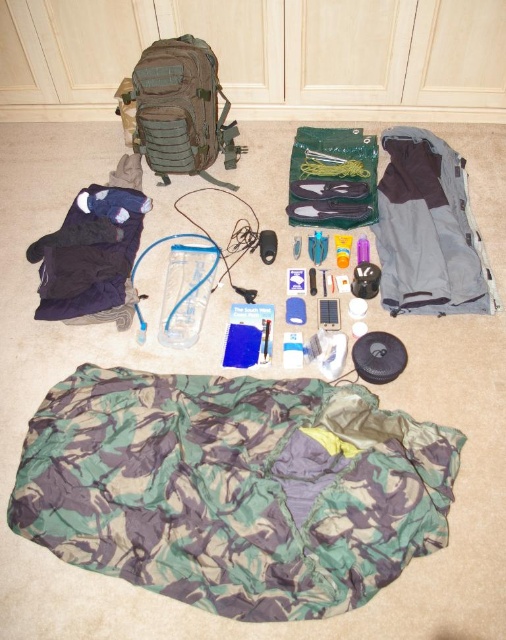
You are standing at the origin point in the image. Which object is located at point (233, 488)?

The camouflage fabric sleeping bag at lower center is located at point (233, 488).

You are standing in the middle of the room and see two points marked on the floor. The first point is at coordinate point[159,492] and the second point is at coordinate point[202,42]. Which point is closer to you?

Point[159,492] is in front of point[202,42], so it is closer to you.

You are standing at the origin point in the image and looking towards the beige carpeted floor. Which of the two points, point (158, 99) or point (62, 237), is closer to you?

Point (62, 237) is closer to you because it is in front of point (158, 99).